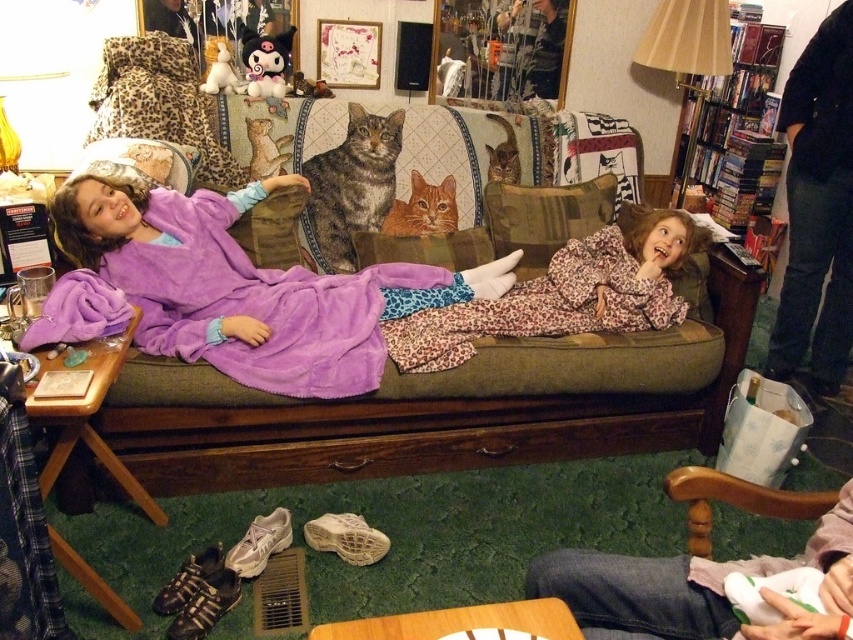
You are a guest in this living room and want to place a new decorative item on the leopard print pillow at center. However, you notice the wooden bookshelf at upper right is directly above it. Should you avoid placing heavy items on the pillow to prevent damage from falling objects?

The wooden bookshelf at upper right is above the leopard print pillow at center, so placing heavy items on the pillow might risk damage if something falls from the bookshelf. It is advisable to avoid heavy items on the pillow.

You are standing in the room and want to pick up an object. There are two points marked in the image. The first point is at coordinate point (531, 563) and the second is at coordinate point (538, 236). Which point is closer to you?

Point (531, 563) is closer to the camera than point (538, 236).

You are helping to arrange pillows on the green couch. The scene shows a brown textured pillow at center and a leopard print pillow at center. Which pillow is located to the right of the other?

The brown textured pillow at center is positioned on the right side of leopard print pillow at center.